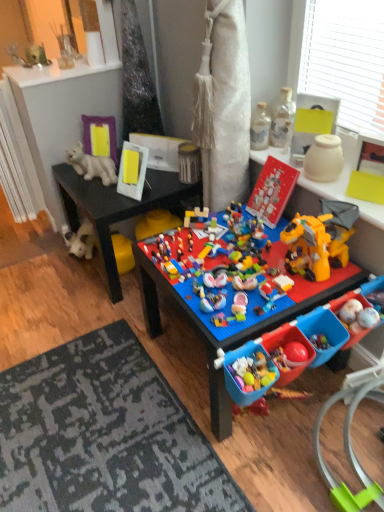
This screenshot has height=512, width=384. I want to click on free space in front of white matte polar bear at upper left, which is the sixth toy in right-to-left order, so click(100, 192).